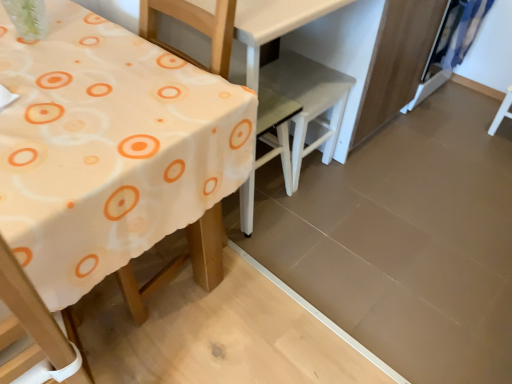
In order to click on white fabric table at left in this screenshot , I will do `click(108, 148)`.

What is the approximate height of white plastic chair at center, the second chair when ordered from left to right?

white plastic chair at center, the second chair when ordered from left to right, is 16.98 inches in height.

I want to click on white plastic chair at center, arranged as the first chair when viewed from the left, so click(270, 150).

In the scene shown: Can we say white fabric table at left lies outside white plastic chair at center, the first chair in the right-to-left sequence?

Absolutely, white fabric table at left is external to white plastic chair at center, the first chair in the right-to-left sequence.

From a real-world perspective, does white fabric table at left sit lower than white plastic chair at center, the second chair when ordered from left to right?

No, from a real-world perspective, white fabric table at left is not under white plastic chair at center, the second chair when ordered from left to right.

Considering the sizes of objects white fabric table at left and white plastic chair at center, the second chair when ordered from left to right, in the image provided, who is smaller, white fabric table at left or white plastic chair at center, the second chair when ordered from left to right,?

white plastic chair at center, the second chair when ordered from left to right.

Considering the positions of objects white fabric table at left and white plastic chair at center, the second chair from the right, in the image provided, who is more to the left, white fabric table at left or white plastic chair at center, the second chair from the right,?

white fabric table at left.

Can we say white fabric table at left lies outside white plastic chair at center, the second chair from the right?

Yes.

Consider the image. Does white fabric table at left turn towards white plastic chair at center, the second chair from the right?

No, white fabric table at left does not turn towards white plastic chair at center, the second chair from the right.

Is there a large distance between white plastic chair at center, the second chair when ordered from left to right, and blue fabric curtain at upper right?

That's not correct — white plastic chair at center, the second chair when ordered from left to right, is a little close to blue fabric curtain at upper right.

From the image's perspective, which object appears higher, white plastic chair at center, the second chair when ordered from left to right, or blue fabric curtain at upper right?

From the image's view, blue fabric curtain at upper right is above.

In terms of width, does white plastic chair at center, the first chair in the right-to-left sequence, look wider or thinner when compared to blue fabric curtain at upper right?

In the image, white plastic chair at center, the first chair in the right-to-left sequence, appears to be wider than blue fabric curtain at upper right.

Is white plastic chair at center, the first chair in the right-to-left sequence, turned away from blue fabric curtain at upper right?

white plastic chair at center, the first chair in the right-to-left sequence, does not have its back to blue fabric curtain at upper right.

Considering the sizes of objects white plastic chair at center, the second chair from the right, and white plastic chair at center, the second chair when ordered from left to right, in the image provided, who is smaller, white plastic chair at center, the second chair from the right, or white plastic chair at center, the second chair when ordered from left to right,?

white plastic chair at center, the second chair from the right.

Locate an element on the screen. chair above the white plastic chair at center, arranged as the first chair when viewed from the left (from the image's perspective) is located at coordinates (309, 101).

Between white plastic chair at center, arranged as the first chair when viewed from the left, and white plastic chair at center, the second chair when ordered from left to right, which one appears on the right side from the viewer's perspective?

Positioned to the right is white plastic chair at center, the second chair when ordered from left to right.

How much distance is there between white plastic chair at center, arranged as the first chair when viewed from the left, and white plastic chair at center, the second chair when ordered from left to right?

white plastic chair at center, arranged as the first chair when viewed from the left, is 5.93 inches from white plastic chair at center, the second chair when ordered from left to right.

Which of these two, white plastic chair at center, the second chair when ordered from left to right, or white fabric table at left, is wider?

white fabric table at left.

Locate an element on the screen. table positioned vertically above the white plastic chair at center, the second chair when ordered from left to right (from a real-world perspective) is located at coordinates (108, 148).

Is white plastic chair at center, the second chair when ordered from left to right, with white fabric table at left?

white plastic chair at center, the second chair when ordered from left to right, and white fabric table at left are not in contact.

Consider the image. From the image's perspective, between white plastic chair at center, the second chair when ordered from left to right, and white fabric table at left, who is located below?

From the image's view, white fabric table at left is below.

Consider the image. Would you say blue fabric curtain at upper right is part of white plastic chair at center, the second chair from the right,'s contents?

No, blue fabric curtain at upper right is not inside white plastic chair at center, the second chair from the right.

This screenshot has width=512, height=384. Find the location of `the 2nd chair in front of the blue fabric curtain at upper right, starting your count from the anchor`. the 2nd chair in front of the blue fabric curtain at upper right, starting your count from the anchor is located at coordinates (270, 150).

Are white plastic chair at center, the second chair from the right, and blue fabric curtain at upper right beside each other?

No, white plastic chair at center, the second chair from the right, is not making contact with blue fabric curtain at upper right.

From the image's perspective, is blue fabric curtain at upper right under white plastic chair at center, the second chair when ordered from left to right?

Incorrect, from the image's perspective, blue fabric curtain at upper right is higher than white plastic chair at center, the second chair when ordered from left to right.

Is blue fabric curtain at upper right at the right side of white plastic chair at center, the first chair in the right-to-left sequence?

Yes.

The width and height of the screenshot is (512, 384). I want to click on curtain above the white plastic chair at center, the second chair when ordered from left to right (from a real-world perspective), so click(x=458, y=32).

Does blue fabric curtain at upper right have a larger size compared to white plastic chair at center, the second chair when ordered from left to right?

Incorrect, blue fabric curtain at upper right is not larger than white plastic chair at center, the second chair when ordered from left to right.

From a real-world perspective, count 2nd chairs downward from the white fabric table at left and point to it. Please provide its 2D coordinates.

[(309, 101)]

You are a GUI agent. You are given a task and a screenshot of the screen. Output one action in this format:
    pyautogui.click(x=<x>, y=<y>)
    Task: Click on the chair below the white fabric table at left (from the image's perspective)
    
    Given the screenshot: What is the action you would take?
    pyautogui.click(x=270, y=150)

When comparing their distances from white fabric table at left, does white plastic chair at center, arranged as the first chair when viewed from the left, or white plastic chair at center, the second chair when ordered from left to right, seem further?

white plastic chair at center, the second chair when ordered from left to right.

When comparing their distances from white fabric table at left, does white plastic chair at center, the first chair in the right-to-left sequence, or blue fabric curtain at upper right seem closer?

white plastic chair at center, the first chair in the right-to-left sequence.

When comparing their distances from blue fabric curtain at upper right, does white plastic chair at center, the first chair in the right-to-left sequence, or white fabric table at left seem further?

Based on the image, white fabric table at left appears to be further to blue fabric curtain at upper right.

Considering their positions, is white plastic chair at center, arranged as the first chair when viewed from the left, positioned further to white fabric table at left than blue fabric curtain at upper right?

blue fabric curtain at upper right is positioned further to the anchor white fabric table at left.

Which object lies nearer to the anchor point white fabric table at left, blue fabric curtain at upper right or white plastic chair at center, the second chair from the right?

The object closer to white fabric table at left is white plastic chair at center, the second chair from the right.

When comparing their distances from white plastic chair at center, the second chair from the right, does white fabric table at left or white plastic chair at center, the second chair when ordered from left to right, seem closer?

Based on the image, white plastic chair at center, the second chair when ordered from left to right, appears to be nearer to white plastic chair at center, the second chair from the right.

Considering their positions, is white fabric table at left positioned further to white plastic chair at center, the first chair in the right-to-left sequence, than blue fabric curtain at upper right?

Among the two, white fabric table at left is located further to white plastic chair at center, the first chair in the right-to-left sequence.

Looking at the image, which one is located further to white plastic chair at center, the second chair when ordered from left to right, white fabric table at left or white plastic chair at center, arranged as the first chair when viewed from the left?

white fabric table at left is further to white plastic chair at center, the second chair when ordered from left to right.

The height and width of the screenshot is (384, 512). What are the coordinates of `chair located between white fabric table at left and white plastic chair at center, the second chair when ordered from left to right, in the depth direction` in the screenshot? It's located at click(x=270, y=150).

I want to click on chair between white plastic chair at center, arranged as the first chair when viewed from the left, and blue fabric curtain at upper right, in the horizontal direction, so click(309, 101).